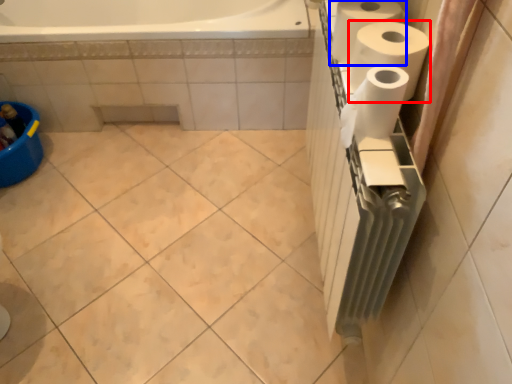
Question: Which of the following is the farthest to the observer, paper towel (highlighted by a red box) or paper towel (highlighted by a blue box)?

Choices:
 (A) paper towel
 (B) paper towel

Answer: (B)